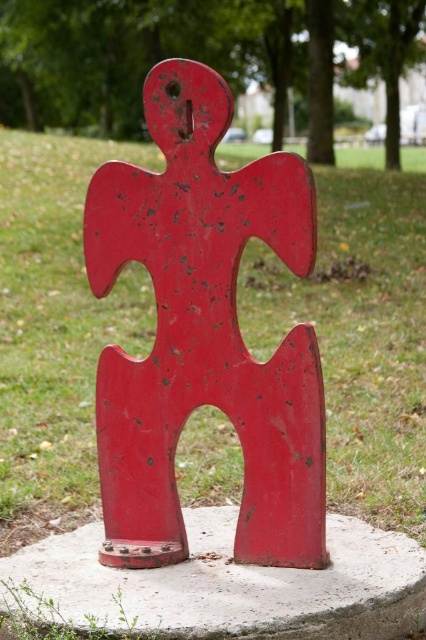
Describe the element at coordinates (359, 332) in the screenshot. I see `green grass at center` at that location.

Can you confirm if green grass at center is bigger than concrete at center?

Yes, green grass at center is bigger than concrete at center.

Which is behind, point (43, 275) or point (186, 608)?

Positioned behind is point (43, 275).

Locate an element on the screen. The width and height of the screenshot is (426, 640). green grass at center is located at coordinates (359, 332).